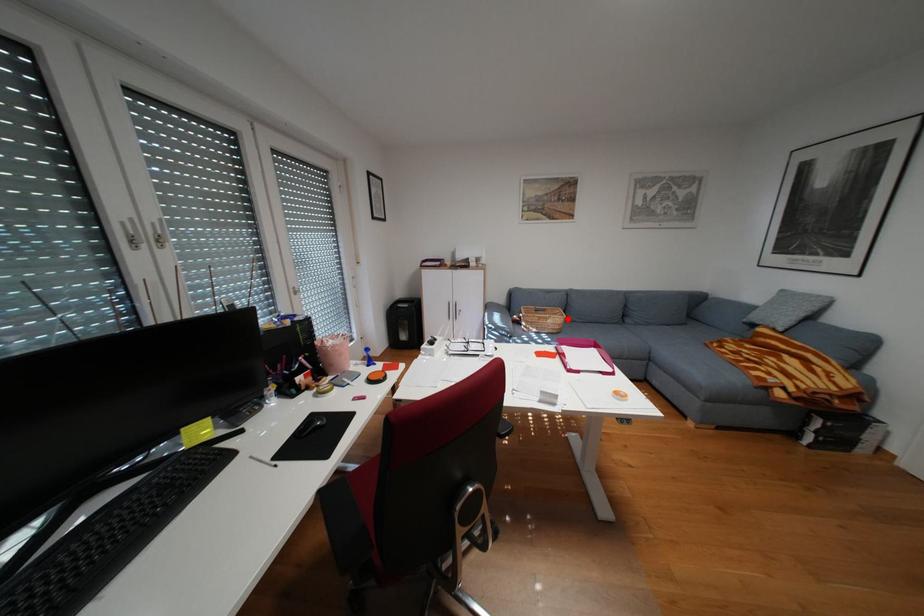
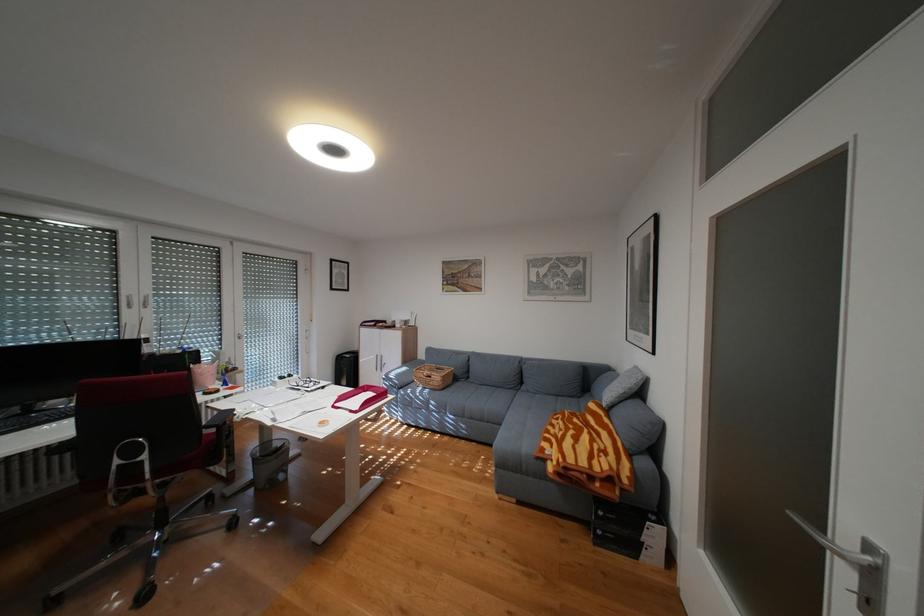
Question: I am providing you with two images of the same scene from different viewpoints. Given a red point in image1, look at the same physical point in image2. Is it:

Choices:
 (A) Closer to the viewpoint
 (B) Farther from the viewpoint

Answer: (B)